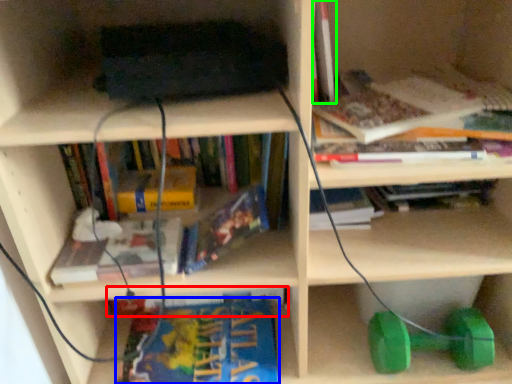
Question: Which object is the farthest from book (highlighted by a red box)? Choose among these: book (highlighted by a blue box) or book (highlighted by a green box).

Choices:
 (A) book
 (B) book

Answer: (B)